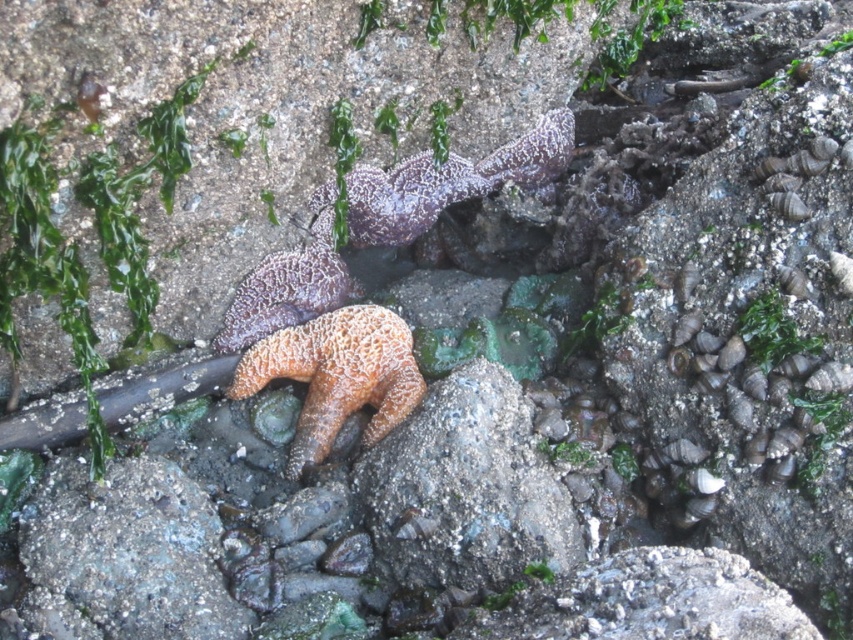
Consider the image. You are a marine biologist observing this coastal scene. You notice the textured purple starfish at center and the green matte algae at center right. Which of these two organisms is positioned higher up in the image?

The textured purple starfish at center is positioned above the green matte algae at center right, so it is higher up in the image.

You are a marine biologist studying starfish in a rocky coastal area. You observe an orange rough starfish at center and a purple matte starfish at center. Which of these two starfish is taller?

The orange rough starfish at center is taller than the purple matte starfish at center.

You are a marine biologist examining the rocky coast. You notice two starfish species here. The first is a purple matte starfish at center, and the second is a textured purple starfish at center. Which of these two starfish is larger?

The purple matte starfish at center is bigger than the textured purple starfish at center.